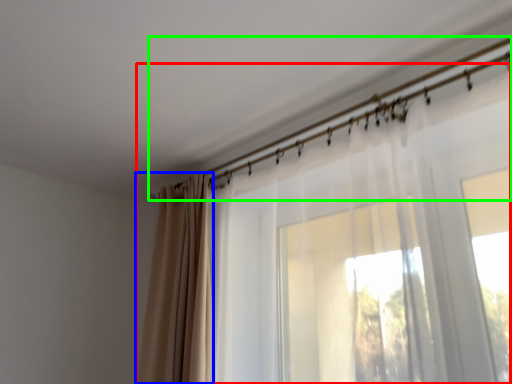
Question: Based on their relative distances, which object is nearer to curtain (highlighted by a red box)? Choose from curtain (highlighted by a blue box) and clothesline (highlighted by a green box).

Choices:
 (A) curtain
 (B) clothesline

Answer: (B)